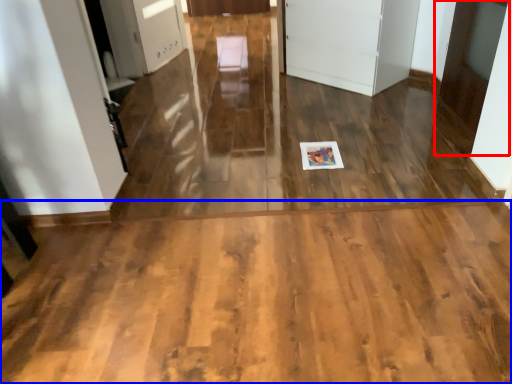
Question: Which object appears closest to the camera in this image, door (highlighted by a red box) or corridor (highlighted by a blue box)?

Choices:
 (A) door
 (B) corridor

Answer: (B)